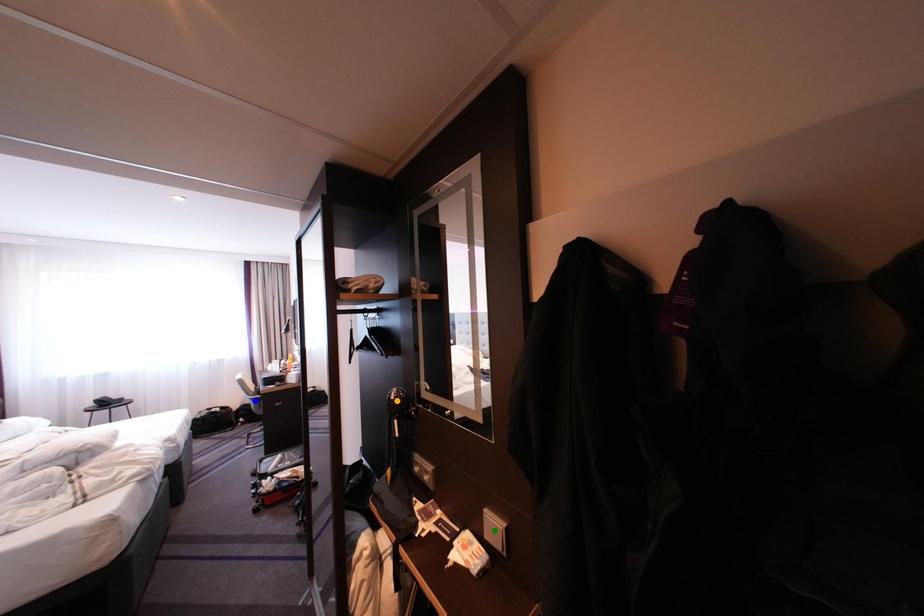
From the picture: Order these from farthest to nearest:
- green point
- orange point
- blue point

blue point < orange point < green point